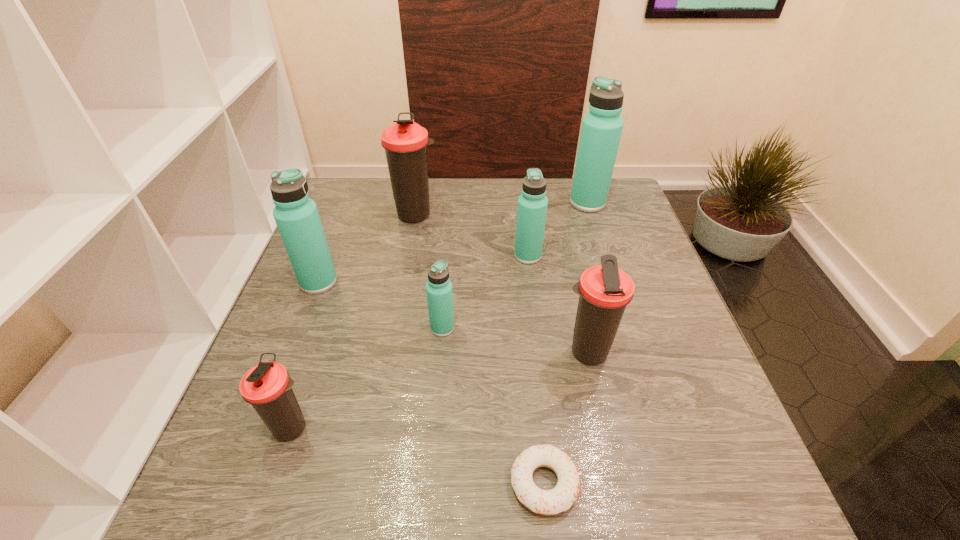
Where is `free space located 0.370m on the back of the rightmost brown thermos bottle`? The height and width of the screenshot is (540, 960). free space located 0.370m on the back of the rightmost brown thermos bottle is located at coordinates (561, 231).

Where is `vacant region located on the right of the fourth thermos bottle from left to right`? Image resolution: width=960 pixels, height=540 pixels. vacant region located on the right of the fourth thermos bottle from left to right is located at coordinates (595, 328).

Identify the location of free space located 0.140m on the back of the leftmost brown thermos bottle. (319, 348).

I want to click on vacant space located on the right of the shortest object, so click(650, 483).

The width and height of the screenshot is (960, 540). What are the coordinates of `object located at the near edge` in the screenshot? It's located at (546, 502).

This screenshot has height=540, width=960. Identify the location of object present at the right edge. (601, 130).

The height and width of the screenshot is (540, 960). Identify the location of object situated at the far right corner. (601, 130).

Identify the location of vacant space at the far edge of the desktop. The image size is (960, 540). (495, 193).

Where is `vacant region at the near edge`? This screenshot has height=540, width=960. vacant region at the near edge is located at coordinates (337, 498).

In the image, there is a desktop. Identify the location of blank space at the left edge. (341, 246).